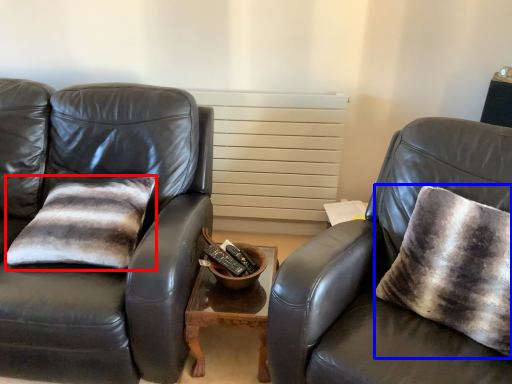
Question: Which object appears farthest to the camera in this image, pillow (highlighted by a red box) or throw pillow (highlighted by a blue box)?

Choices:
 (A) pillow
 (B) throw pillow

Answer: (A)